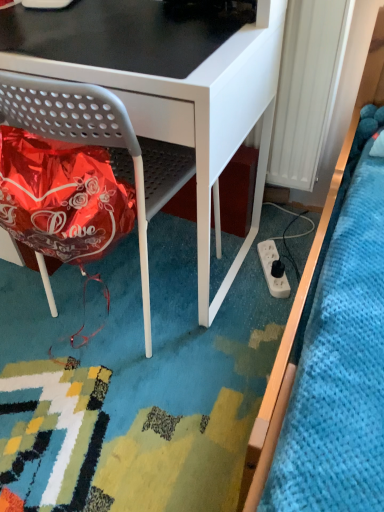
This screenshot has width=384, height=512. What are the coordinates of `free space in front of matte gray chair at lower left` in the screenshot? It's located at click(147, 400).